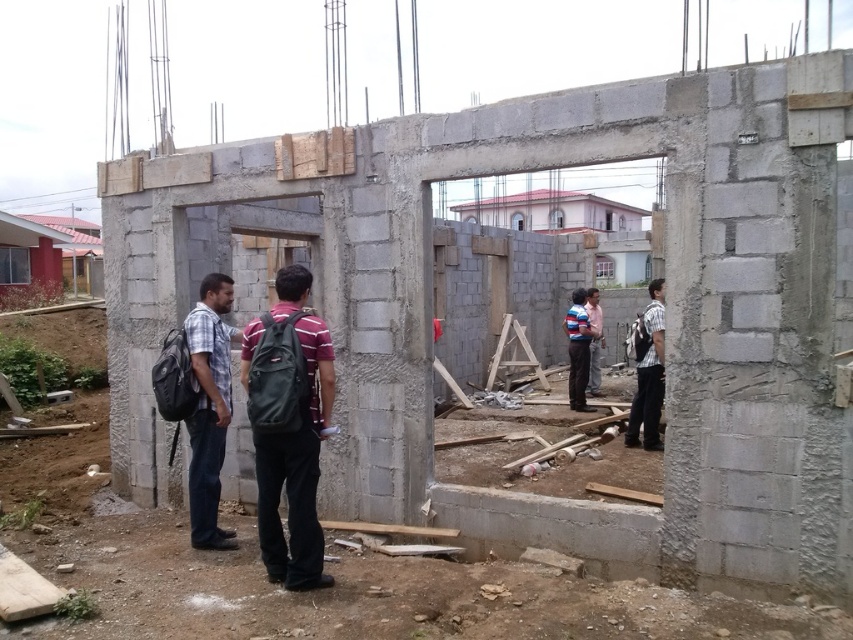
You are a construction inspector standing at point (654, 376). You need to walk to point (270, 435) to check the structural integrity of the building. Is the path between these two points clear of any obstacles?

Point (270, 435) is in front of point (654, 376), so the path between them is clear of obstacles.